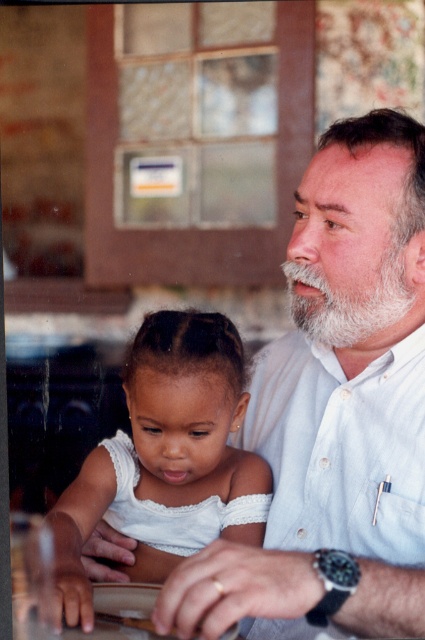
Measure the distance between white lace dress at center and white fuzzy beard at upper right.

They are 9.86 inches apart.

Does white lace dress at center have a greater height compared to white fuzzy beard at upper right?

Indeed, white lace dress at center has a greater height compared to white fuzzy beard at upper right.

Identify the location of white lace dress at center. Image resolution: width=425 pixels, height=640 pixels. (167, 460).

Who is taller, white shirt at center or white lace dress at center?

white shirt at center is taller.

Can you confirm if white shirt at center is taller than white lace dress at center?

Correct, white shirt at center is much taller as white lace dress at center.

This screenshot has width=425, height=640. Find the location of `white shirt at center`. white shirt at center is located at coordinates (334, 406).

Does white shirt at center appear on the left side of white fuzzy beard at upper right?

Correct, you'll find white shirt at center to the left of white fuzzy beard at upper right.

What do you see at coordinates (334, 406) in the screenshot?
I see `white shirt at center` at bounding box center [334, 406].

You are a GUI agent. You are given a task and a screenshot of the screen. Output one action in this format:
    pyautogui.click(x=<x>, y=<y>)
    Task: Click on the white shirt at center
    This screenshot has width=425, height=640.
    Given the screenshot: What is the action you would take?
    pyautogui.click(x=334, y=406)